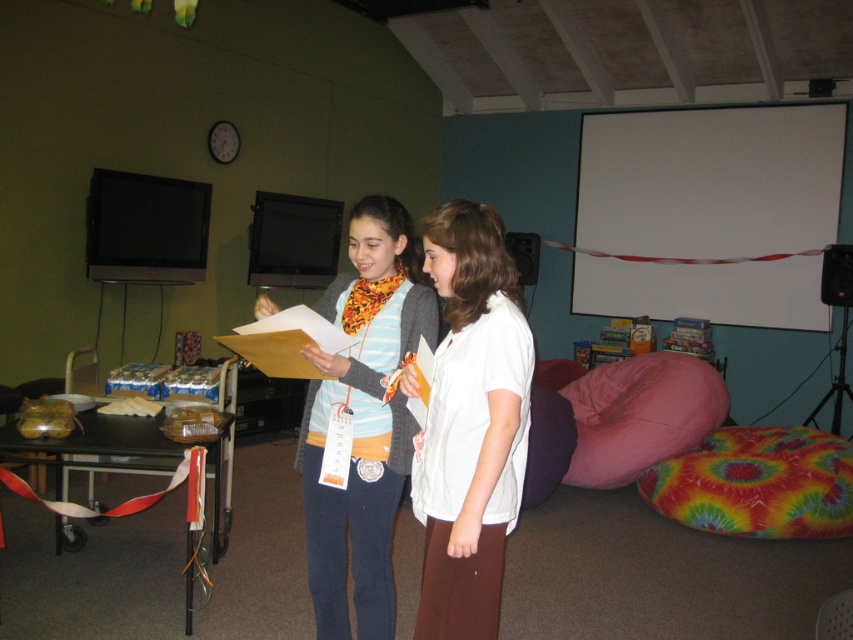
Question: Estimate the real-world distances between objects in this image. Which object is farther from the white cotton shirt at center?

Choices:
 (A) pink fabric bean bag at lower right
 (B) striped cotton shirt at center
 (C) white matte projection screen at upper center

Answer: (C)

Question: Which object appears closest to the camera in this image?

Choices:
 (A) white matte projection screen at upper center
 (B) white cotton shirt at center
 (C) pink fabric bean bag at lower right

Answer: (B)

Question: Is white cotton shirt at center above striped cotton shirt at center?

Choices:
 (A) yes
 (B) no

Answer: (A)

Question: Does white cotton shirt at center appear on the right side of striped cotton shirt at center?

Choices:
 (A) yes
 (B) no

Answer: (A)

Question: Considering the real-world distances, which object is closest to the white matte projection screen at upper center?

Choices:
 (A) pink fabric bean bag at lower right
 (B) striped cotton shirt at center

Answer: (A)

Question: Does white matte projection screen at upper center have a greater width compared to white cotton shirt at center?

Choices:
 (A) yes
 (B) no

Answer: (A)